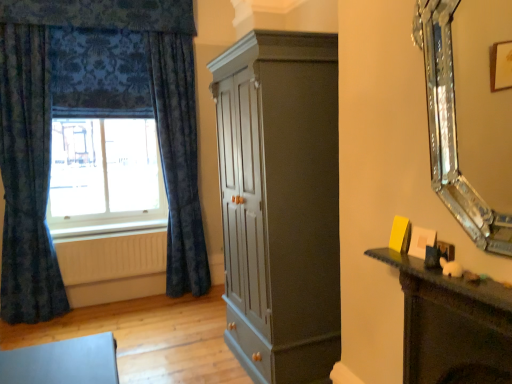
You are a GUI agent. You are given a task and a screenshot of the screen. Output one action in this format:
    pyautogui.click(x=<x>, y=<y>)
    Task: Click on the velvety blue curtain at left, the first curtain viewed from the right
    The image size is (512, 384).
    Given the screenshot: What is the action you would take?
    pyautogui.click(x=178, y=159)

Identify the location of wooden radiator at lower left. The width and height of the screenshot is (512, 384). (112, 257).

Locate an element on the screen. The height and width of the screenshot is (384, 512). silver/glass mirror at right is located at coordinates (452, 131).

Describe the element at coordinates (280, 203) in the screenshot. I see `matte gray cupboard at center` at that location.

Measure the distance between point (117, 221) and camera.

The distance of point (117, 221) from camera is 13.10 feet.

Where is `dark blue textured curtain at left, the second curtain positioned from the right`? dark blue textured curtain at left, the second curtain positioned from the right is located at coordinates (27, 178).

Between dark blue textured curtain at left, marked as the first curtain in a left-to-right arrangement, and wooden radiator at lower left, which one has larger width?

dark blue textured curtain at left, marked as the first curtain in a left-to-right arrangement, is wider.

Looking at this image, which point is more distant from viewer, (38, 185) or (80, 274)?

The point (80, 274) is farther from the camera.

Which is more to the left, dark blue textured curtain at left, marked as the first curtain in a left-to-right arrangement, or wooden radiator at lower left?

dark blue textured curtain at left, marked as the first curtain in a left-to-right arrangement.

Between wooden radiator at lower left and silver/glass mirror at right, which one has smaller width?

With smaller width is wooden radiator at lower left.

Does wooden radiator at lower left appear on the left side of silver/glass mirror at right?

Correct, you'll find wooden radiator at lower left to the left of silver/glass mirror at right.

The width and height of the screenshot is (512, 384). I want to click on mirror that appears in front of the wooden radiator at lower left, so click(x=452, y=131).

Can you confirm if wooden radiator at lower left is smaller than silver/glass mirror at right?

Yes.

Where is `radiator behind the matte gray cupboard at center`? radiator behind the matte gray cupboard at center is located at coordinates (112, 257).

From the image's perspective, between wooden radiator at lower left and matte gray cupboard at center, who is located below?

wooden radiator at lower left, from the image's perspective.

Which is closer, (147, 252) or (326, 256)?

Point (147, 252) is positioned farther from the camera compared to point (326, 256).

How many degrees apart are the facing directions of wooden radiator at lower left and matte gray cupboard at center?

89.7 degrees.

Considering the sizes of wooden radiator at lower left and velvety blue curtain at left, which is the 2th curtain from left to right, in the image, is wooden radiator at lower left wider or thinner than velvety blue curtain at left, which is the 2th curtain from left to right,?

Clearly, wooden radiator at lower left has less width compared to velvety blue curtain at left, which is the 2th curtain from left to right.

Considering the positions of objects wooden radiator at lower left and velvety blue curtain at left, which is the 2th curtain from left to right, in the image provided, who is more to the left, wooden radiator at lower left or velvety blue curtain at left, which is the 2th curtain from left to right,?

wooden radiator at lower left.

Considering the points (132, 248) and (189, 123), which point is behind, point (132, 248) or point (189, 123)?

Point (189, 123)

Measure the distance from wooden radiator at lower left to velvety blue curtain at left, which is the 2th curtain from left to right.

The distance of wooden radiator at lower left from velvety blue curtain at left, which is the 2th curtain from left to right, is 23.63 inches.

Would you say dark blue textured curtain at left, the second curtain positioned from the right, is outside blue velvet curtains at left?

dark blue textured curtain at left, the second curtain positioned from the right, lies outside blue velvet curtains at left's area.

From the image's perspective, which one is positioned higher, dark blue textured curtain at left, marked as the first curtain in a left-to-right arrangement, or blue velvet curtains at left?

blue velvet curtains at left appears higher in the image.

Between point (31, 165) and point (92, 188), which one is positioned behind?

Positioned behind is point (92, 188).

Looking at the image, does dark blue textured curtain at left, marked as the first curtain in a left-to-right arrangement, seem bigger or smaller compared to blue velvet curtains at left?

In the image, dark blue textured curtain at left, marked as the first curtain in a left-to-right arrangement, appears to be larger than blue velvet curtains at left.

Is wooden radiator at lower left at the back of white wood at lower left?

white wood at lower left is not turned away from wooden radiator at lower left.

Who is shorter, white wood at lower left or wooden radiator at lower left?

white wood at lower left is shorter.

Which object is further away from the camera taking this photo, white wood at lower left or wooden radiator at lower left?

white wood at lower left is further from the camera.

Measure the distance from white wood at lower left to wooden radiator at lower left.

white wood at lower left is 7.62 inches from wooden radiator at lower left.

Who is smaller, velvety blue curtain at left, the first curtain viewed from the right, or silver/glass mirror at right?

silver/glass mirror at right.

Is velvety blue curtain at left, the first curtain viewed from the right, behind silver/glass mirror at right?

Yes, the depth of velvety blue curtain at left, the first curtain viewed from the right, is greater than that of silver/glass mirror at right.

Considering the relative sizes of velvety blue curtain at left, the first curtain viewed from the right, and silver/glass mirror at right in the image provided, is velvety blue curtain at left, the first curtain viewed from the right, wider than silver/glass mirror at right?

Yes, velvety blue curtain at left, the first curtain viewed from the right, is wider than silver/glass mirror at right.

Considering the positions of point (176, 150) and point (437, 8), is point (176, 150) closer or farther from the camera than point (437, 8)?

Point (176, 150) is positioned farther from the camera compared to point (437, 8).

Where is `radiator that is on the right side of dark blue textured curtain at left, marked as the first curtain in a left-to-right arrangement`? This screenshot has height=384, width=512. radiator that is on the right side of dark blue textured curtain at left, marked as the first curtain in a left-to-right arrangement is located at coordinates (112, 257).

Identify the location of mirror above the wooden radiator at lower left (from the image's perspective). This screenshot has height=384, width=512. (452, 131).

From the image, which object appears to be nearer to wooden radiator at lower left, velvety blue curtain at left, which is the 2th curtain from left to right, or matte gray cupboard at center?

The object closer to wooden radiator at lower left is velvety blue curtain at left, which is the 2th curtain from left to right.

From the image, which object appears to be farther from velvety blue curtain at left, which is the 2th curtain from left to right, blue velvet curtains at left or white wood at lower left?

Based on the image, white wood at lower left appears to be further to velvety blue curtain at left, which is the 2th curtain from left to right.

Considering their positions, is blue velvet curtains at left positioned further to white wood at lower left than velvety blue curtain at left, the first curtain viewed from the right?

Based on the image, velvety blue curtain at left, the first curtain viewed from the right, appears to be further to white wood at lower left.

Based on their spatial positions, is white wood at lower left or wooden radiator at lower left closer to velvety blue curtain at left, which is the 2th curtain from left to right?

wooden radiator at lower left is closer to velvety blue curtain at left, which is the 2th curtain from left to right.

When comparing their distances from wooden radiator at lower left, does dark blue textured curtain at left, marked as the first curtain in a left-to-right arrangement, or blue velvet curtains at left seem closer?

The object closer to wooden radiator at lower left is dark blue textured curtain at left, marked as the first curtain in a left-to-right arrangement.

Considering their positions, is velvety blue curtain at left, which is the 2th curtain from left to right, positioned further to silver/glass mirror at right than wooden radiator at lower left?

wooden radiator at lower left.

When comparing their distances from matte gray cupboard at center, does dark blue textured curtain at left, marked as the first curtain in a left-to-right arrangement, or velvety blue curtain at left, the first curtain viewed from the right, seem closer?

Based on the image, velvety blue curtain at left, the first curtain viewed from the right, appears to be nearer to matte gray cupboard at center.

From the picture: When comparing their distances from wooden radiator at lower left, does dark blue textured curtain at left, marked as the first curtain in a left-to-right arrangement, or velvety blue curtain at left, the first curtain viewed from the right, seem further?

velvety blue curtain at left, the first curtain viewed from the right.

At what (x,y) coordinates should I click in order to perform the action: click on window situated between dark blue textured curtain at left, marked as the first curtain in a left-to-right arrangement, and matte gray cupboard at center from left to right. Please return your answer as a coordinate pair (x, y). This screenshot has height=384, width=512. Looking at the image, I should click on (103, 136).

Image resolution: width=512 pixels, height=384 pixels. Find the location of `radiator between matte gray cupboard at center and white wood at lower left along the z-axis`. radiator between matte gray cupboard at center and white wood at lower left along the z-axis is located at coordinates (112, 257).

Image resolution: width=512 pixels, height=384 pixels. What are the coordinates of `window sill that lies between blue velvet curtains at left and wooden radiator at lower left from top to bottom` in the screenshot? It's located at (106, 229).

Locate an element on the screen. window situated between dark blue textured curtain at left, marked as the first curtain in a left-to-right arrangement, and velvety blue curtain at left, which is the 2th curtain from left to right, from left to right is located at coordinates (103, 136).